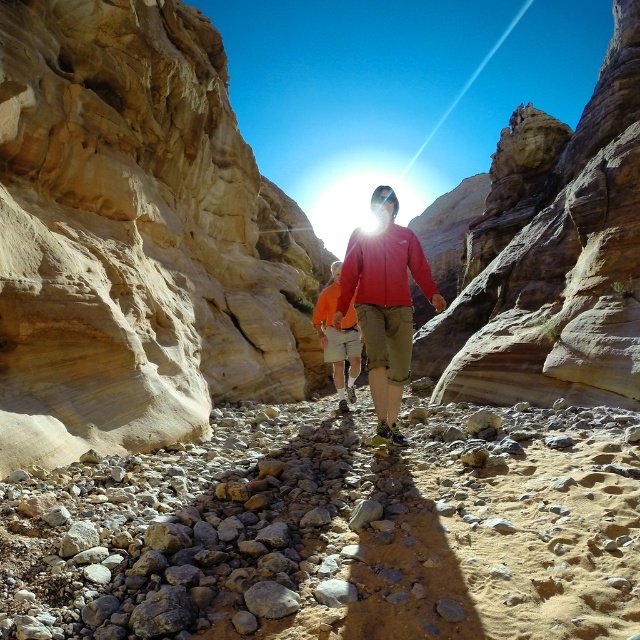
Question: Is smooth sandstone rock at center below orange cotton shirt at center?

Choices:
 (A) no
 (B) yes

Answer: (A)

Question: Which point is farther to the camera?

Choices:
 (A) orange cotton shirt at center
 (B) smooth sandstone rock at center
 (C) smooth beige rock at center
 (D) matte red jacket at center

Answer: (A)

Question: Does smooth beige rock at center appear over orange cotton shirt at center?

Choices:
 (A) yes
 (B) no

Answer: (A)

Question: Which object appears closest to the camera in this image?

Choices:
 (A) matte red jacket at center
 (B) smooth beige rock at center
 (C) orange cotton shirt at center
 (D) smooth sandstone rock at center

Answer: (B)

Question: Estimate the real-world distances between objects in this image. Which object is closer to the smooth sandstone rock at center?

Choices:
 (A) smooth beige rock at center
 (B) matte red jacket at center
 (C) orange cotton shirt at center

Answer: (B)

Question: Does matte red jacket at center have a lesser width compared to orange cotton shirt at center?

Choices:
 (A) yes
 (B) no

Answer: (B)